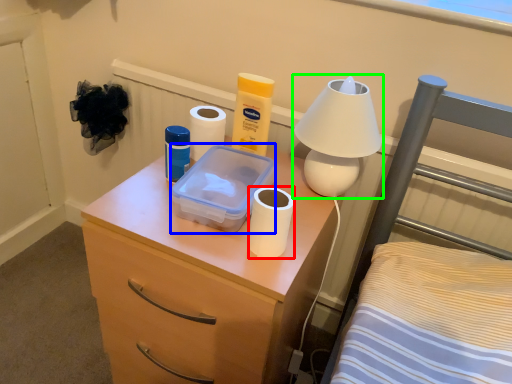
Question: Considering the real-world distances, which object is closest to toilet paper (highlighted by a red box)? storage box (highlighted by a blue box) or lamp (highlighted by a green box).

Choices:
 (A) storage box
 (B) lamp

Answer: (A)